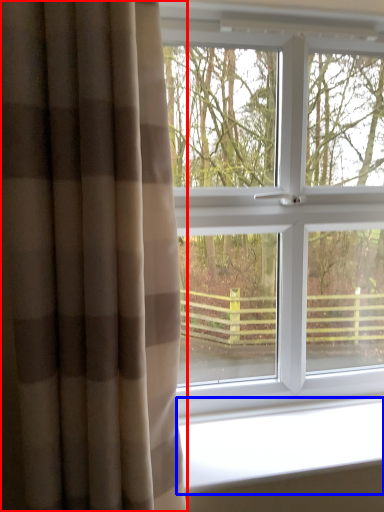
Question: Which of the following is the closest to the observer, curtain (highlighted by a red box) or window sill (highlighted by a blue box)?

Choices:
 (A) curtain
 (B) window sill

Answer: (A)